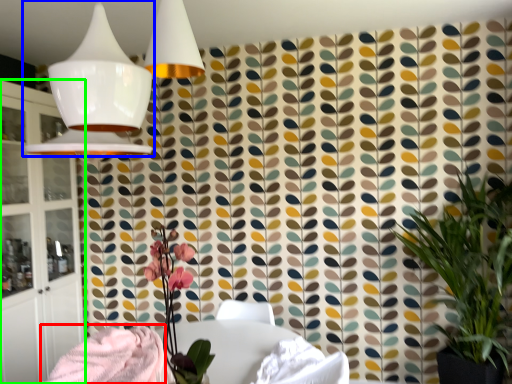
Question: Which is farther away from blanket (highlighted by a red box)? lamp (highlighted by a blue box) or cabinetry (highlighted by a green box)?

Choices:
 (A) lamp
 (B) cabinetry

Answer: (B)